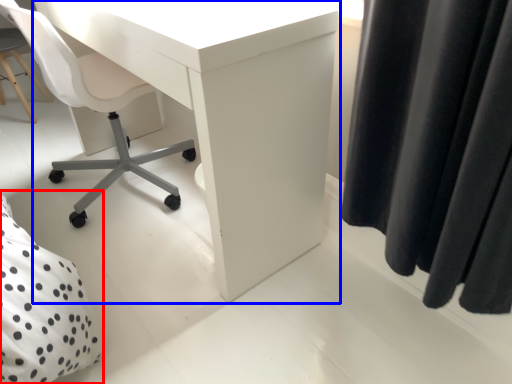
Question: Which point is closer to the camera, bed (highlighted by a red box) or desk (highlighted by a blue box)?

Choices:
 (A) bed
 (B) desk

Answer: (A)